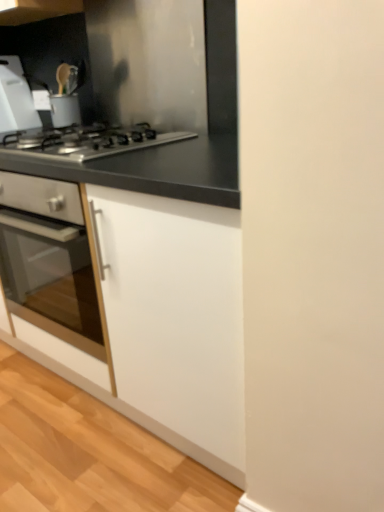
Question: Is black matte countertop at upper left smaller than stainless steel gas stove at center?

Choices:
 (A) no
 (B) yes

Answer: (B)

Question: Can you confirm if black matte countertop at upper left is shorter than stainless steel gas stove at center?

Choices:
 (A) no
 (B) yes

Answer: (A)

Question: Does black matte countertop at upper left have a greater width compared to stainless steel gas stove at center?

Choices:
 (A) no
 (B) yes

Answer: (A)

Question: Considering the relative sizes of black matte countertop at upper left and stainless steel gas stove at center in the image provided, is black matte countertop at upper left thinner than stainless steel gas stove at center?

Choices:
 (A) yes
 (B) no

Answer: (A)

Question: Would you say black matte countertop at upper left is a long distance from stainless steel gas stove at center?

Choices:
 (A) no
 (B) yes

Answer: (A)

Question: From the image's perspective, is stainless steel gas stove at center above or below white matte cabinet at center?

Choices:
 (A) above
 (B) below

Answer: (A)

Question: From a real-world perspective, is stainless steel gas stove at center above or below white matte cabinet at center?

Choices:
 (A) above
 (B) below

Answer: (A)

Question: Would you say stainless steel gas stove at center is inside or outside white matte cabinet at center?

Choices:
 (A) inside
 (B) outside

Answer: (A)

Question: In the image, is stainless steel gas stove at center positioned in front of or behind white matte cabinet at center?

Choices:
 (A) front
 (B) behind

Answer: (B)

Question: In the image, is white plastic cutting board at upper left positioned in front of or behind stainless steel gas stove at center?

Choices:
 (A) behind
 (B) front

Answer: (A)

Question: In terms of width, does white plastic cutting board at upper left look wider or thinner when compared to stainless steel gas stove at center?

Choices:
 (A) wide
 (B) thin

Answer: (B)

Question: Is white plastic cutting board at upper left bigger or smaller than stainless steel gas stove at center?

Choices:
 (A) big
 (B) small

Answer: (B)

Question: Is point click(3, 70) positioned closer to the camera than point click(62, 138)?

Choices:
 (A) closer
 (B) farther

Answer: (B)

Question: Is stainless steel gas stove at center wider or thinner than white plastic cutting board at upper left?

Choices:
 (A) wide
 (B) thin

Answer: (A)

Question: Is stainless steel gas stove at center situated inside white plastic cutting board at upper left or outside?

Choices:
 (A) inside
 (B) outside

Answer: (B)